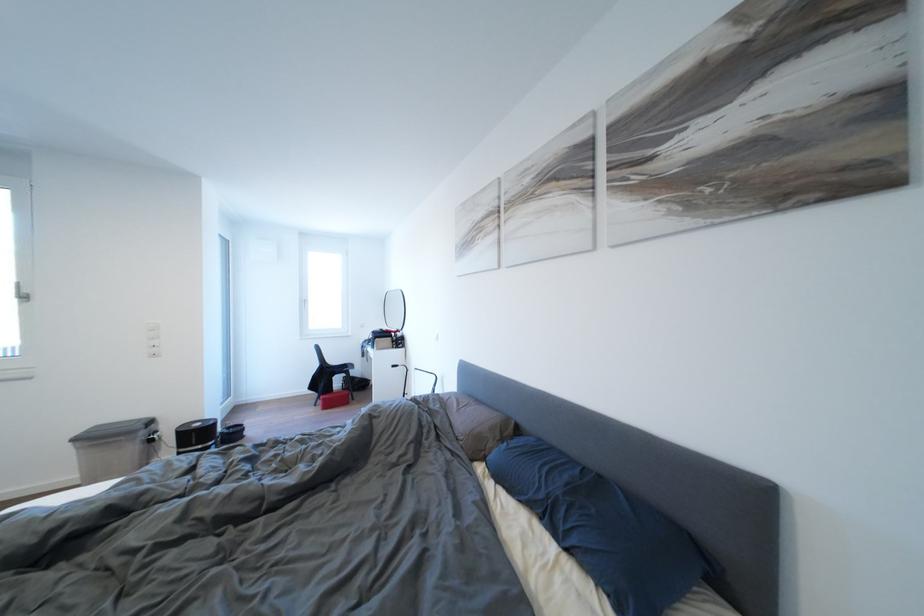
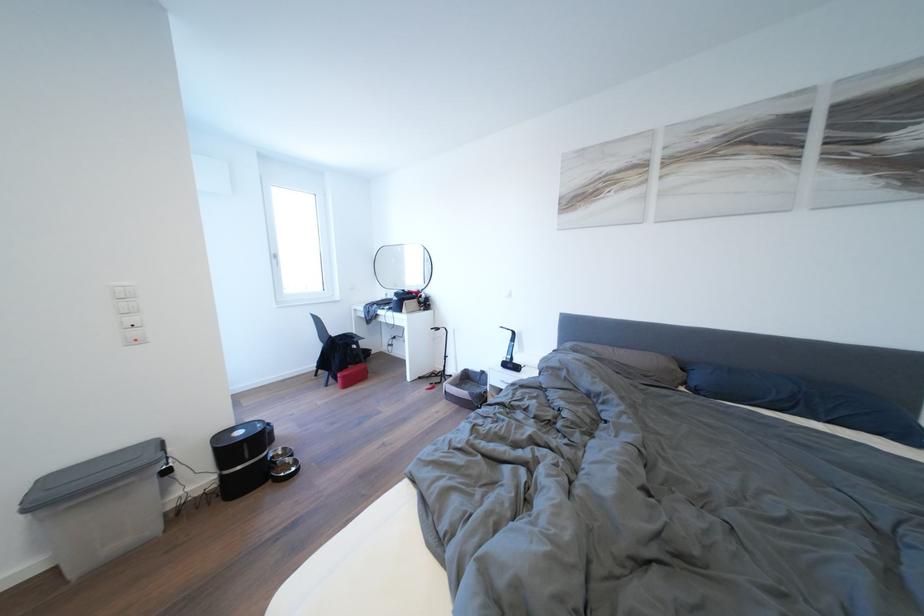
The point at (332, 399) is marked in the first image. Where is the corresponding point in the second image?

(348, 376)